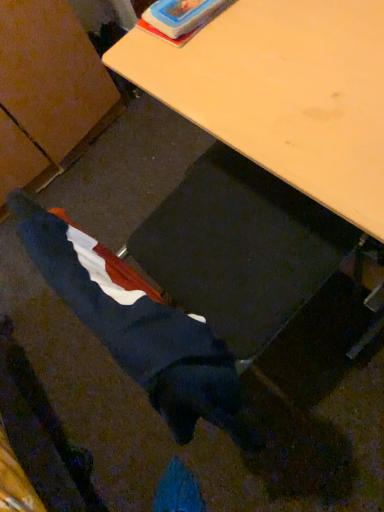
Identify the location of empty space that is ontop of wooden desk at center. (271, 51).